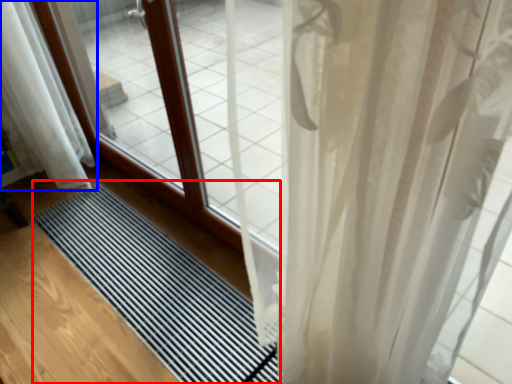
Question: Which object is closer to the camera taking this photo, mat (highlighted by a red box) or curtain (highlighted by a blue box)?

Choices:
 (A) mat
 (B) curtain

Answer: (A)